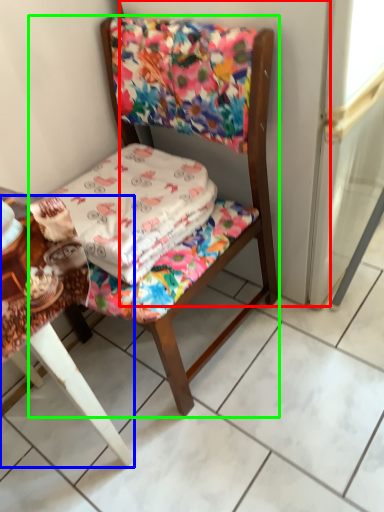
Question: Considering the real-world distances, which object is closest to screen door (highlighted by a red box)? table (highlighted by a blue box) or chair (highlighted by a green box).

Choices:
 (A) table
 (B) chair

Answer: (B)